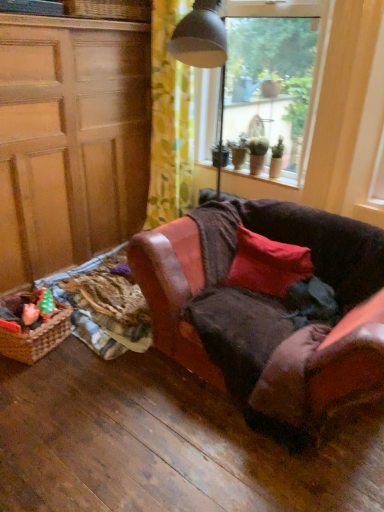
Image resolution: width=384 pixels, height=512 pixels. Find the location of `empty space that is ontop of smooth wooden window sill at upper center`. empty space that is ontop of smooth wooden window sill at upper center is located at coordinates (248, 172).